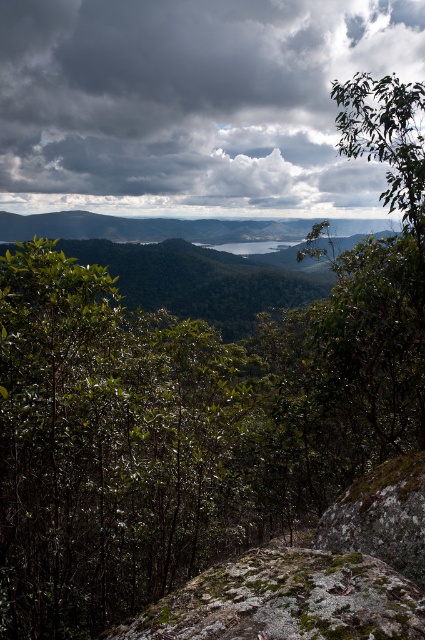
Question: Considering the real-world distances, which object is farthest from the green mossy rock at lower right?

Choices:
 (A) mossy rock at center
 (B) dark gray cloud at upper center

Answer: (B)

Question: Which object is farther from the camera taking this photo?

Choices:
 (A) dark gray cloud at upper center
 (B) mossy rock at center

Answer: (A)

Question: Does dark gray cloud at upper center come behind green mossy rock at lower right?

Choices:
 (A) no
 (B) yes

Answer: (B)

Question: Does mossy rock at center come in front of green mossy rock at lower right?

Choices:
 (A) yes
 (B) no

Answer: (A)

Question: Which object appears closest to the camera in this image?

Choices:
 (A) dark gray cloud at upper center
 (B) green mossy rock at lower right
 (C) mossy rock at center

Answer: (C)

Question: Is mossy rock at center further to camera compared to green mossy rock at lower right?

Choices:
 (A) yes
 (B) no

Answer: (B)